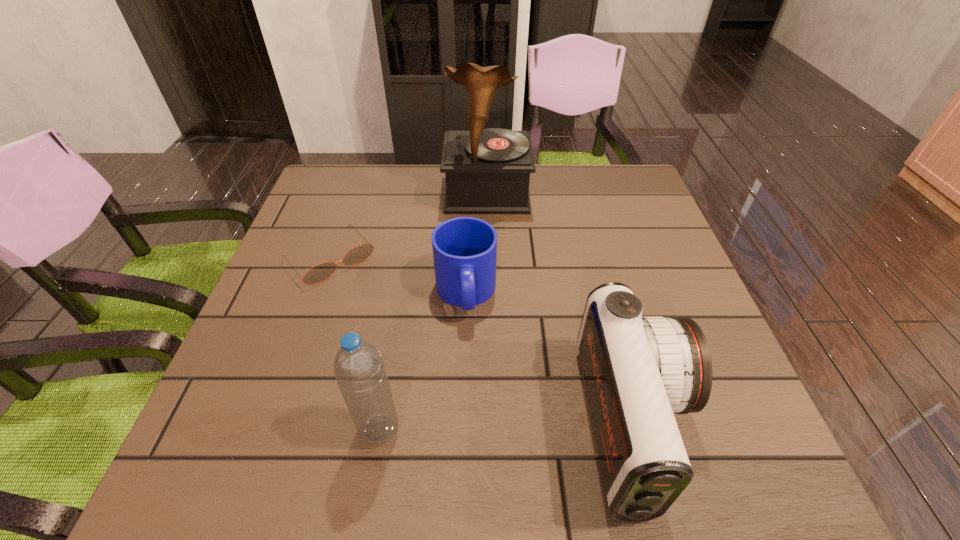
Where is `vacant space at the far right corner`? Image resolution: width=960 pixels, height=540 pixels. vacant space at the far right corner is located at coordinates click(591, 192).

Locate an element on the screen. The image size is (960, 540). unoccupied position between the second tallest object and the mug is located at coordinates (422, 362).

Where is `free space between the camcorder and the sunglasses`? free space between the camcorder and the sunglasses is located at coordinates (482, 341).

You are a GUI agent. You are given a task and a screenshot of the screen. Output one action in this format:
    pyautogui.click(x=<x>, y=<y>)
    Task: Click on the empty space that is in between the second shortest object and the camcorder
    Image resolution: width=960 pixels, height=540 pixels.
    Given the screenshot: What is the action you would take?
    pyautogui.click(x=550, y=359)

You are a GUI agent. You are given a task and a screenshot of the screen. Output one action in this format:
    pyautogui.click(x=<x>, y=<y>)
    Task: Click on the free space that is in between the fourth shortest object and the fourth tallest object
    
    Given the screenshot: What is the action you would take?
    pyautogui.click(x=422, y=362)

In order to click on free spot between the second tallest object and the mug in this screenshot , I will do `click(422, 362)`.

At what (x,y) coordinates should I click in order to perform the action: click on vacant area that lies between the farthest object and the fourth shortest object. Please return your answer as a coordinate pair (x, y). This screenshot has width=960, height=540. Looking at the image, I should click on (433, 312).

This screenshot has height=540, width=960. Identify the location of free space between the leftmost object and the rightmost object. (482, 341).

This screenshot has width=960, height=540. What are the coordinates of `free space that is in between the third shortest object and the sunglasses` in the screenshot? It's located at (482, 341).

Find the location of a particular element. blank region between the fourth tallest object and the camcorder is located at coordinates (550, 359).